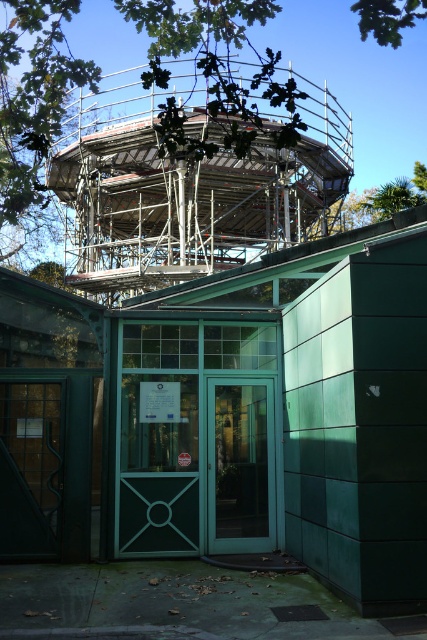
You are standing at the entrance of the building and want to know the distance between the metallic scaffolding at upper center and the green leafy tree at upper center. Can you estimate how far apart they are?

The metallic scaffolding at upper center is 83.27 feet away from the green leafy tree at upper center.

You are standing in front of the building and notice a point marked at coordinates (230, 417). What object is located at that point?

The point at (230, 417) has metallic scaffolding at upper center located there.